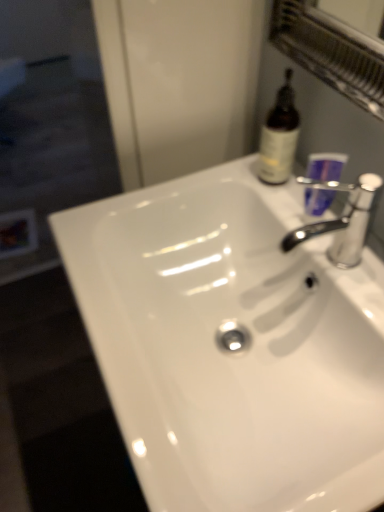
Question: Is transparent glass screen door at left looking in the opposite direction of purple plastic cup at upper right?

Choices:
 (A) yes
 (B) no

Answer: (B)

Question: From a real-world perspective, is transparent glass screen door at left positioned under purple plastic cup at upper right based on gravity?

Choices:
 (A) yes
 (B) no

Answer: (A)

Question: Can you confirm if transparent glass screen door at left is taller than purple plastic cup at upper right?

Choices:
 (A) yes
 (B) no

Answer: (B)

Question: Is transparent glass screen door at left not close to purple plastic cup at upper right?

Choices:
 (A) yes
 (B) no

Answer: (A)

Question: Can you confirm if transparent glass screen door at left is bigger than purple plastic cup at upper right?

Choices:
 (A) yes
 (B) no

Answer: (A)

Question: From a real-world perspective, is brown glass bottle at upper right above or below white glossy sink at center?

Choices:
 (A) below
 (B) above

Answer: (B)

Question: In terms of size, does brown glass bottle at upper right appear bigger or smaller than white glossy sink at center?

Choices:
 (A) small
 (B) big

Answer: (A)

Question: Visually, is brown glass bottle at upper right positioned to the left or to the right of white glossy sink at center?

Choices:
 (A) left
 (B) right

Answer: (B)

Question: Is brown glass bottle at upper right situated inside white glossy sink at center or outside?

Choices:
 (A) inside
 (B) outside

Answer: (B)

Question: Which is correct: silver metallic faucet at upper right is inside white glossy sink at center, or outside of it?

Choices:
 (A) outside
 (B) inside

Answer: (A)

Question: In the image, is silver metallic faucet at upper right on the left side or the right side of white glossy sink at center?

Choices:
 (A) left
 (B) right

Answer: (B)

Question: In terms of height, does silver metallic faucet at upper right look taller or shorter compared to white glossy sink at center?

Choices:
 (A) short
 (B) tall

Answer: (B)

Question: Is point (309, 184) closer or farther from the camera than point (334, 334)?

Choices:
 (A) closer
 (B) farther

Answer: (B)

Question: In terms of height, does purple plastic cup at upper right look taller or shorter compared to white glossy sink at center?

Choices:
 (A) short
 (B) tall

Answer: (B)

Question: From a real-world perspective, is purple plastic cup at upper right physically located above or below white glossy sink at center?

Choices:
 (A) above
 (B) below

Answer: (A)